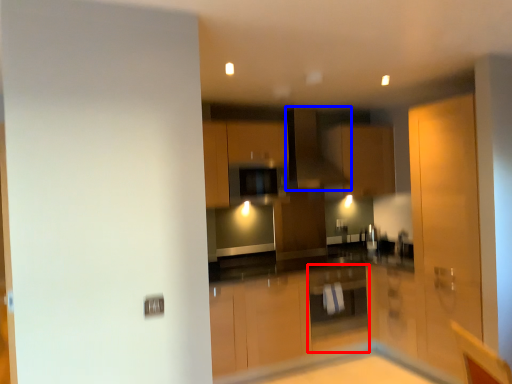
Question: Which point is closer to the camera, cabinetry (highlighted by a red box) or exhaust hood (highlighted by a blue box)?

Choices:
 (A) cabinetry
 (B) exhaust hood

Answer: (A)